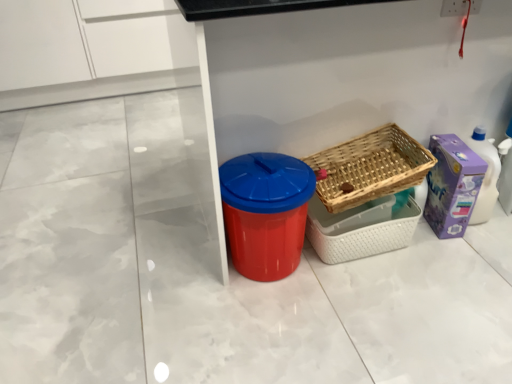
This screenshot has height=384, width=512. I want to click on blank space situated above purple cardboard box at right (from a real-world perspective), so click(x=456, y=144).